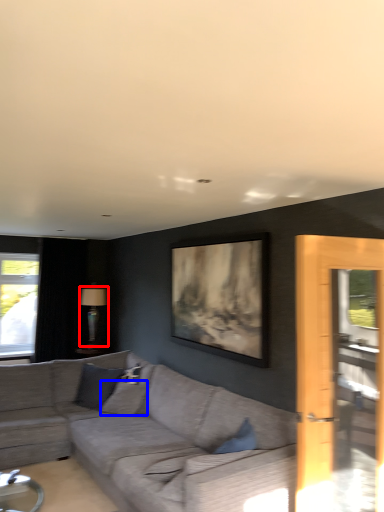
Question: Which object is closer to the camera taking this photo, lamp (highlighted by a red box) or pillow (highlighted by a blue box)?

Choices:
 (A) lamp
 (B) pillow

Answer: (B)